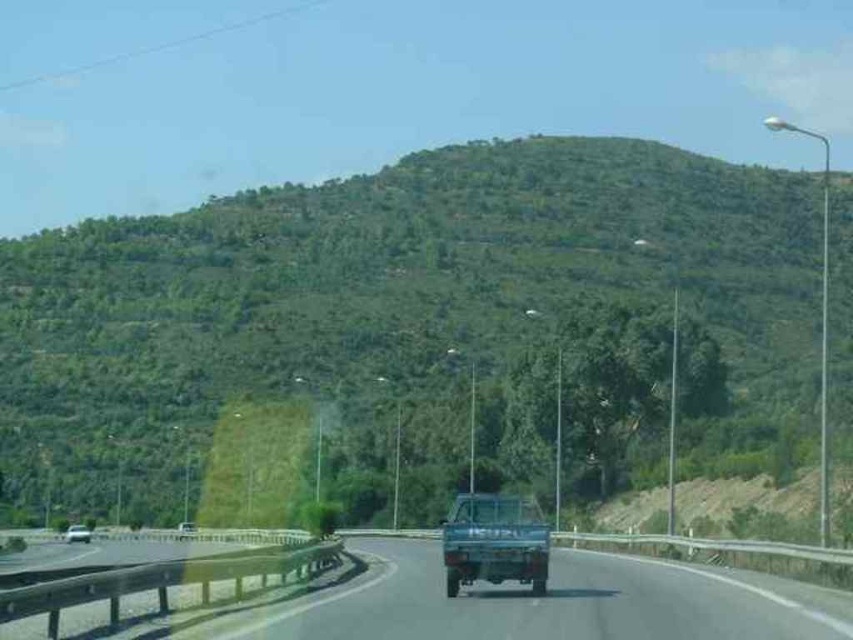
Question: Does metallic gray truck at center lie behind metallic silver car at lower left?

Choices:
 (A) no
 (B) yes

Answer: (A)

Question: Can you confirm if green leafy hillside at center is smaller than metallic silver car at lower left?

Choices:
 (A) no
 (B) yes

Answer: (A)

Question: Which point is closer to the camera taking this photo?

Choices:
 (A) (477, 524)
 (B) (86, 531)
 (C) (22, 336)

Answer: (A)

Question: Which of the following is the farthest from the observer?

Choices:
 (A) metallic blue truck at center
 (B) green leafy hillside at center
 (C) metallic gray truck at center

Answer: (B)

Question: Which object is the farthest from the metallic gray truck at center?

Choices:
 (A) metallic silver car at lower left
 (B) green leafy hillside at center

Answer: (B)

Question: In this image, where is metallic gray truck at center located relative to metallic blue truck at center?

Choices:
 (A) right
 (B) left

Answer: (B)